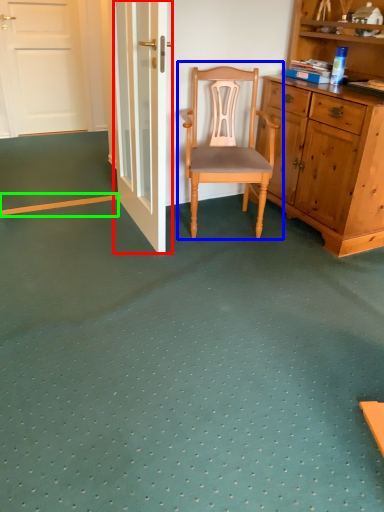
Question: Which object is the farthest from door (highlighted by a red box)? Choose among these: chair (highlighted by a blue box) or strip (highlighted by a green box).

Choices:
 (A) chair
 (B) strip

Answer: (B)